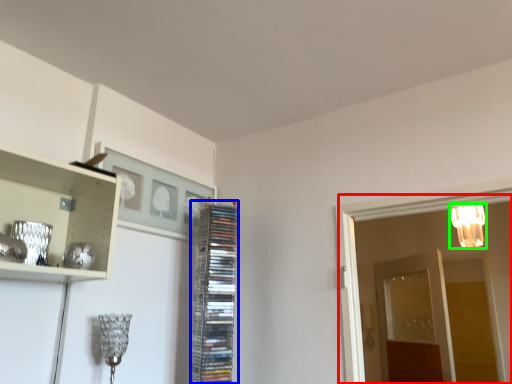
Question: Considering the real-world distances, which object is farthest from glass door (highlighted by a red box)? cabinet (highlighted by a blue box) or lamp (highlighted by a green box)?

Choices:
 (A) cabinet
 (B) lamp

Answer: (B)